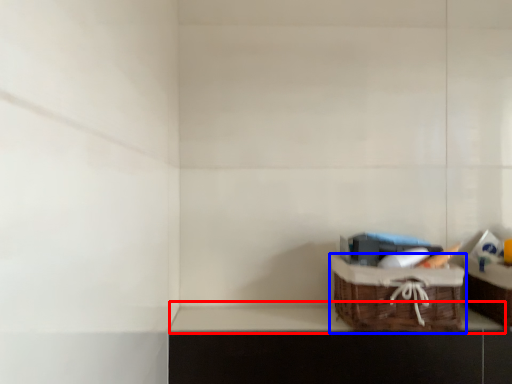
Question: Which object is closer to the camera taking this photo, window sill (highlighted by a red box) or picnic basket (highlighted by a blue box)?

Choices:
 (A) window sill
 (B) picnic basket

Answer: (B)